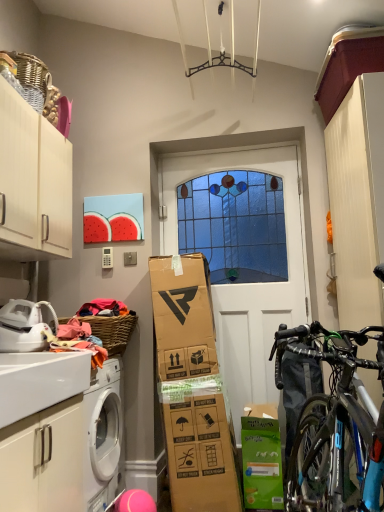
The height and width of the screenshot is (512, 384). Identify the location of green matte cardboard box at lower center. [x=261, y=458].

Image resolution: width=384 pixels, height=512 pixels. What do you see at coordinates (242, 256) in the screenshot?
I see `white matte door at center` at bounding box center [242, 256].

What is the approximate width of white matte cabinet at lower left, arranged as the first cabinetry when ordered from the bottom?

It is 17.75 inches.

This screenshot has width=384, height=512. Find the location of `shiny black bicycle at right`. shiny black bicycle at right is located at coordinates (335, 425).

Locate an element on the screen. white matte cabinet at upper left, marked as the second cabinetry in a bottom-to-top arrangement is located at coordinates (33, 183).

Considering the sizes of white matte cabinet at upper left, marked as the second cabinetry in a bottom-to-top arrangement, and shiny black bicycle at right in the image, is white matte cabinet at upper left, marked as the second cabinetry in a bottom-to-top arrangement, wider or thinner than shiny black bicycle at right?

white matte cabinet at upper left, marked as the second cabinetry in a bottom-to-top arrangement, is wider than shiny black bicycle at right.

Considering the positions of points (38, 183) and (277, 341), is point (38, 183) closer to camera compared to point (277, 341)?

No, (38, 183) is behind (277, 341).

From a real-world perspective, is white matte cabinet at upper left, the first cabinetry when ordered from top to bottom, above or below shiny black bicycle at right?

white matte cabinet at upper left, the first cabinetry when ordered from top to bottom, is situated higher than shiny black bicycle at right in the real world.

The width and height of the screenshot is (384, 512). Find the location of `cabinetry that is the 1st object located in front of the woven brown basket at upper left`. cabinetry that is the 1st object located in front of the woven brown basket at upper left is located at coordinates (33, 183).

Between point (89, 322) and point (8, 253), which one is positioned in front?

The point (8, 253) is more forward.

Who is smaller, woven brown basket at upper left or white matte cabinet at upper left, the first cabinetry when ordered from top to bottom?

With smaller size is woven brown basket at upper left.

Is woven brown basket at upper left at the back of white matte door at center?

No, white matte door at center is not facing away from woven brown basket at upper left.

Can you confirm if white matte door at center is taller than woven brown basket at upper left?

Correct, white matte door at center is much taller as woven brown basket at upper left.

How many degrees apart are the facing directions of white matte door at center and woven brown basket at upper left?

89.5 degrees.

Which of these two, white matte door at center or woven brown basket at upper left, is bigger?

Bigger between the two is white matte door at center.

Between green matte cardboard box at lower center and white matte cabinet at lower left, the second cabinetry positioned from the top, which one has larger width?

With larger width is white matte cabinet at lower left, the second cabinetry positioned from the top.

Considering the positions of points (262, 477) and (46, 466), is point (262, 477) farther from camera compared to point (46, 466)?

Yes, it is behind point (46, 466).

Which object is positioned more to the right, green matte cardboard box at lower center or white matte cabinet at lower left, the second cabinetry positioned from the top?

From the viewer's perspective, green matte cardboard box at lower center appears more on the right side.

Where is `bicycle below the woven brown basket at upper left (from a real-world perspective)`? The width and height of the screenshot is (384, 512). bicycle below the woven brown basket at upper left (from a real-world perspective) is located at coordinates (335, 425).

Which is in front, shiny black bicycle at right or woven brown basket at upper left?

shiny black bicycle at right is in front.

From the image's perspective, is shiny black bicycle at right above or below woven brown basket at upper left?

Based on their image positions, shiny black bicycle at right is located beneath woven brown basket at upper left.

Is shiny black bicycle at right far away from woven brown basket at upper left?

Yes.

Would you consider green matte cardboard box at lower center to be distant from white matte door at center?

Actually, green matte cardboard box at lower center and white matte door at center are a little close together.

From a real-world perspective, is green matte cardboard box at lower center positioned under white matte door at center based on gravity?

Correct, in the physical world, green matte cardboard box at lower center is lower than white matte door at center.

Is green matte cardboard box at lower center oriented away from white matte door at center?

Yes, green matte cardboard box at lower center is positioned with its back facing white matte door at center.

Find the location of a particular element. door that is above the white glossy countertop at lower left (from the image's perspective) is located at coordinates (242, 256).

What's the angular difference between white matte door at center and white glossy countertop at lower left's facing directions?

The angle between the facing direction of white matte door at center and the facing direction of white glossy countertop at lower left is 91.5 degrees.

Is there a large distance between white matte door at center and white glossy countertop at lower left?

Yes, white matte door at center and white glossy countertop at lower left are located far from each other.

From the image's perspective, starting from the shiny black bicycle at right, which cabinetry is the 2nd one above? Please provide its 2D coordinates.

[(33, 183)]

Find the location of a particular element. The width and height of the screenshot is (384, 512). basket below the white matte cabinet at upper left, marked as the second cabinetry in a bottom-to-top arrangement (from the image's perspective) is located at coordinates [113, 330].

Considering their positions, is green matte cardboard box at lower center positioned closer to woven brown basket at upper left than white matte door at center?

white matte door at center is positioned closer to the anchor woven brown basket at upper left.

From the image, which object appears to be nearer to white matte door at center, green matte cardboard box at lower center or woven brown basket at upper left?

Among the two, green matte cardboard box at lower center is located nearer to white matte door at center.

From the image, which object appears to be nearer to white matte door at center, white glossy countertop at lower left or green matte cardboard box at lower center?

green matte cardboard box at lower center.

Estimate the real-world distances between objects in this image. Which object is closer to white matte door at center, white glossy countertop at lower left or white matte cabinet at upper left, marked as the second cabinetry in a bottom-to-top arrangement?

Based on the image, white matte cabinet at upper left, marked as the second cabinetry in a bottom-to-top arrangement, appears to be nearer to white matte door at center.

From the image, which object appears to be farther from white matte cabinet at upper left, the first cabinetry when ordered from top to bottom, white glossy countertop at lower left or woven brown basket at upper left?

white glossy countertop at lower left lies further to white matte cabinet at upper left, the first cabinetry when ordered from top to bottom, than the other object.

Considering their positions, is woven brown basket at upper left positioned further to shiny black bicycle at right than white matte cabinet at upper left, marked as the second cabinetry in a bottom-to-top arrangement?

Among the two, white matte cabinet at upper left, marked as the second cabinetry in a bottom-to-top arrangement, is located further to shiny black bicycle at right.

When comparing their distances from white matte door at center, does white matte cabinet at lower left, the second cabinetry positioned from the top, or white glossy countertop at lower left seem further?

white glossy countertop at lower left is positioned further to the anchor white matte door at center.

Which object lies further to the anchor point shiny black bicycle at right, white glossy countertop at lower left or green matte cardboard box at lower center?

white glossy countertop at lower left is further to shiny black bicycle at right.

The height and width of the screenshot is (512, 384). What are the coordinates of `cabinetry between white glossy countertop at lower left and shiny black bicycle at right from left to right` in the screenshot? It's located at (44, 460).

At what (x,y) coordinates should I click in order to perform the action: click on counter top between white matte cabinet at upper left, the first cabinetry when ordered from top to bottom, and shiny black bicycle at right, in the horizontal direction. Please return your answer as a coordinate pair (x, y). This screenshot has width=384, height=512. Looking at the image, I should click on (40, 381).

The image size is (384, 512). What are the coordinates of `basket between white matte cabinet at lower left, arranged as the first cabinetry when ordered from the bottom, and green matte cardboard box at lower center` in the screenshot? It's located at (113, 330).

Image resolution: width=384 pixels, height=512 pixels. Identify the location of door between woven brown basket at upper left and shiny black bicycle at right. (242, 256).